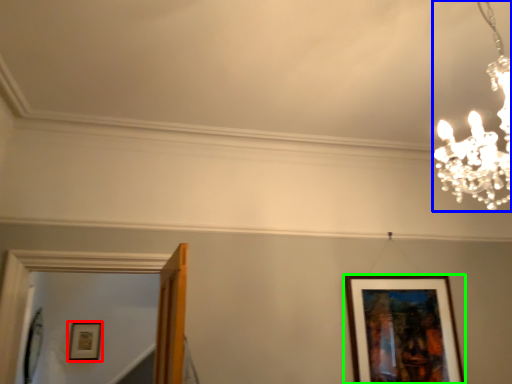
Question: Based on their relative distances, which object is farther from picture frame (highlighted by a red box)? Choose from lamp (highlighted by a blue box) and picture frame (highlighted by a green box).

Choices:
 (A) lamp
 (B) picture frame

Answer: (A)